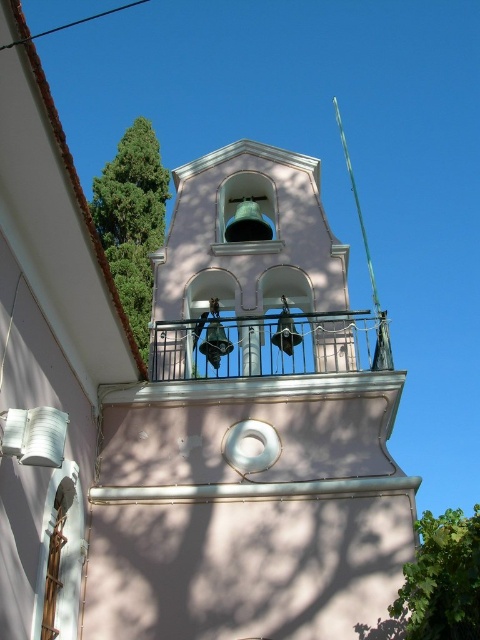
You are standing in front of the bell tower and notice a point marked at coordinates (132, 220). Based on the scene description, can you determine what object this point is located on?

The point at coordinates (132, 220) is located on the green leafy tree at upper left.